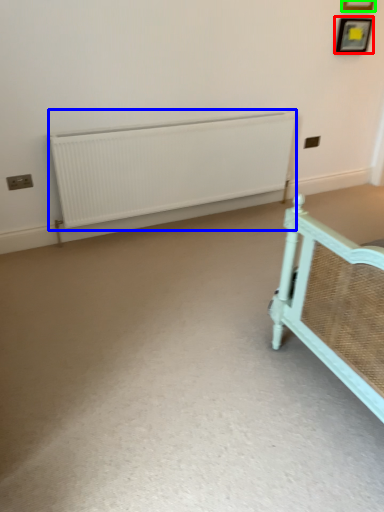
Question: Based on their relative distances, which object is farther from picture frame (highlighted by a red box)? Choose from radiator (highlighted by a blue box) and picture frame (highlighted by a green box).

Choices:
 (A) radiator
 (B) picture frame

Answer: (A)